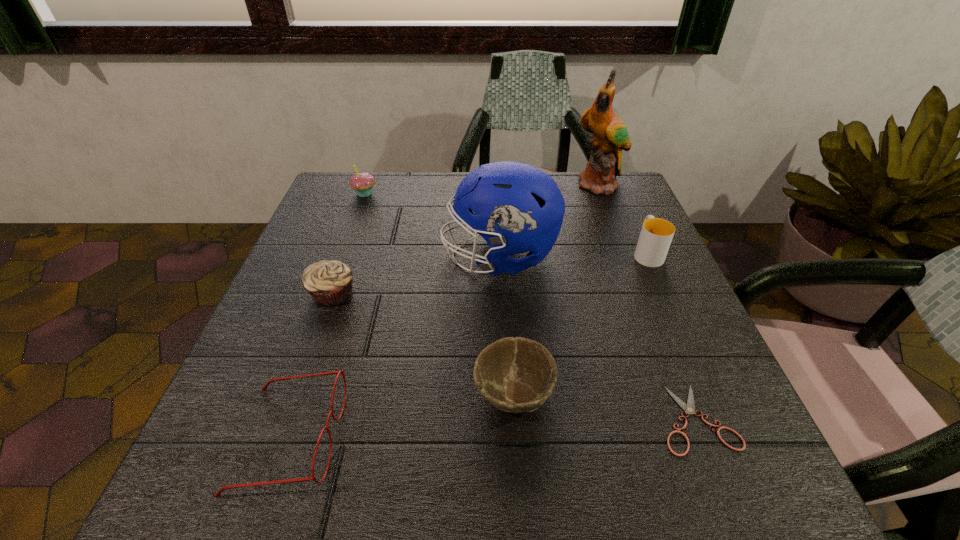
Identify the location of object at the far left corner. The width and height of the screenshot is (960, 540). (363, 182).

Where is `object that is at the near left corner`? This screenshot has height=540, width=960. object that is at the near left corner is located at coordinates (264, 388).

Find the location of a particular element. object located in the far right corner section of the desktop is located at coordinates (610, 136).

Identify the location of object located at the near right corner. (689, 408).

The image size is (960, 540). In the image, there is a desktop. Identify the location of vacant region at the far edge. click(440, 195).

In the image, there is a desktop. At what (x,y) coordinates should I click in order to perform the action: click on vacant space at the near edge. Please return your answer as a coordinate pair (x, y). This screenshot has height=540, width=960. Looking at the image, I should click on (543, 462).

This screenshot has width=960, height=540. I want to click on vacant space at the left edge of the desktop, so click(310, 298).

You are a GUI agent. You are given a task and a screenshot of the screen. Output one action in this format:
    pyautogui.click(x=<x>, y=<y>)
    Task: Click on the vacant space at the right edge of the desktop
    The image size is (960, 540).
    Given the screenshot: What is the action you would take?
    pyautogui.click(x=667, y=313)

You are a GUI agent. You are given a task and a screenshot of the screen. Output one action in this format:
    pyautogui.click(x=<x>, y=<y>)
    Task: Click on the free point at the far left corner
    This screenshot has height=540, width=960.
    Given the screenshot: What is the action you would take?
    pyautogui.click(x=318, y=220)

At what (x,y) coordinates should I click in order to perform the action: click on vacant space at the far right corner. Please return your answer as a coordinate pair (x, y). This screenshot has width=960, height=540. Looking at the image, I should click on (630, 210).